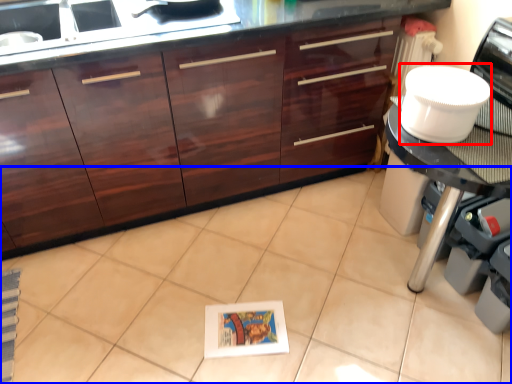
Question: Which object appears closest to the camera in this image, appliance (highlighted by a red box) or ceramic tile (highlighted by a blue box)?

Choices:
 (A) appliance
 (B) ceramic tile

Answer: (B)